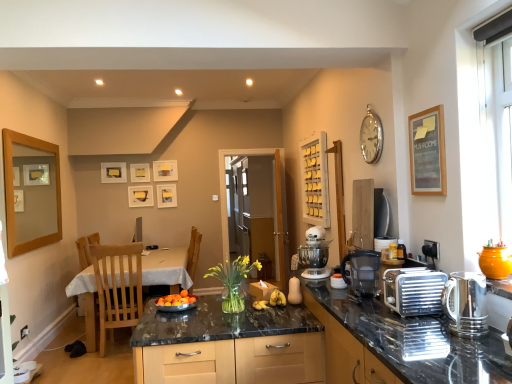
Question: Is white glossy table at lower left inside or outside of silver metallic clock at upper right?

Choices:
 (A) outside
 (B) inside

Answer: (A)

Question: Is point (182, 251) positioned closer to the camera than point (373, 119)?

Choices:
 (A) closer
 (B) farther

Answer: (B)

Question: Which object is positioned farthest from the shiny granite countertop at center?

Choices:
 (A) matte white picture frame at upper center, the third picture frame from the left
 (B) wooden chair at left, which is the first chair from back to front
 (C) sleek metallic kettle at right, which appears as the first kitchen appliance when viewed from the front
 (D) black marble countertop at center
 (E) white matte mixer at center

Answer: (A)

Question: Considering the real-world distances, which object is farthest from the light wood chair at left, the first chair when ordered from front to back?

Choices:
 (A) white matte mixer at center
 (B) silver metallic toaster at right, the first appliance in the back-to-front sequence
 (C) shiny granite countertop at center
 (D) metallic gold picture frame at upper center, the 2th picture frame viewed from the left
 (E) black marble countertop at center

Answer: (B)